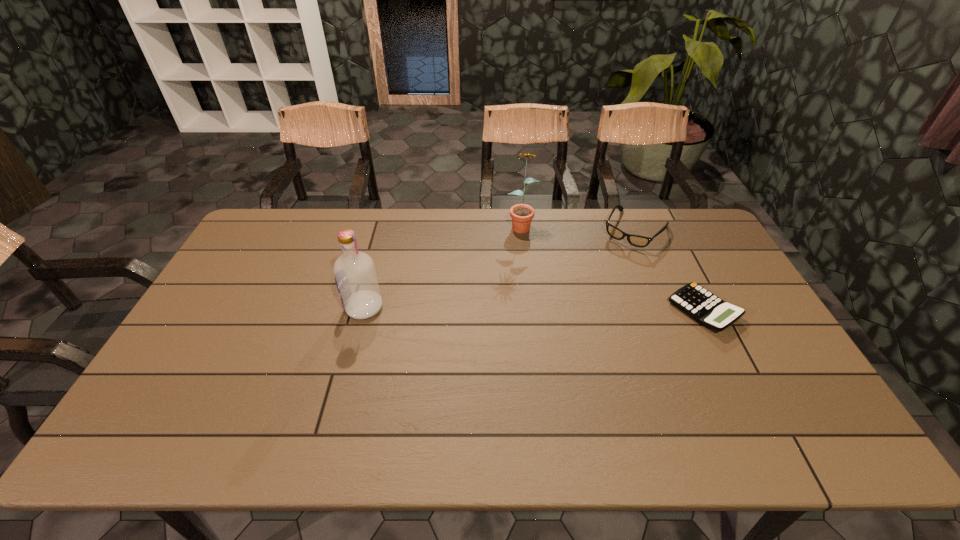
In the image, there is a desktop. What are the coordinates of `free region at the left edge` in the screenshot? It's located at (167, 372).

Identify the location of vacant point at the right edge. (717, 335).

Locate an element on the screen. This screenshot has width=960, height=540. free space at the near left corner of the desktop is located at coordinates (160, 409).

Identify the location of vacant space at the far right corner. (657, 209).

Locate an element on the screen. The image size is (960, 540). free space between the third object from right to left and the spectacles is located at coordinates (578, 227).

At what (x,y) coordinates should I click in order to perform the action: click on free spot between the vodka and the third tallest object. Please return your answer as a coordinate pair (x, y). Looking at the image, I should click on (499, 269).

Where is `free space between the sunflower and the second shortest object`? This screenshot has height=540, width=960. free space between the sunflower and the second shortest object is located at coordinates (578, 227).

Find the location of a particular element. This screenshot has height=540, width=960. free space between the shortest object and the sunflower is located at coordinates (612, 267).

Find the location of `free space between the calculator and the vodka`. free space between the calculator and the vodka is located at coordinates (534, 309).

Identify the location of free space between the leftmost object and the sunflower. The image size is (960, 540). (443, 266).